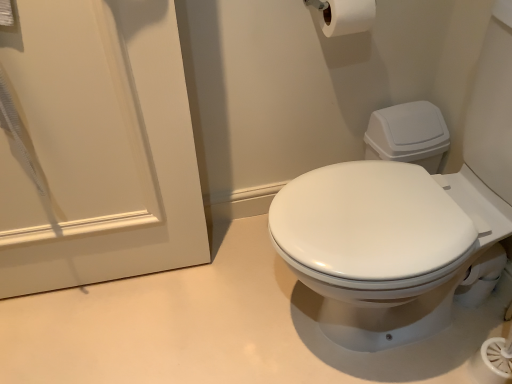
What is the approximate width of white matte toilet paper at upper center?

white matte toilet paper at upper center is 5.51 inches in width.

This screenshot has height=384, width=512. I want to click on white matte toilet paper at upper center, so click(x=347, y=16).

What do you see at coordinates (347, 16) in the screenshot?
I see `white matte toilet paper at upper center` at bounding box center [347, 16].

What do you see at coordinates (98, 146) in the screenshot? The image size is (512, 384). I see `white matte door at upper left` at bounding box center [98, 146].

The height and width of the screenshot is (384, 512). I want to click on white matte door at upper left, so click(x=98, y=146).

In order to face white matte door at upper left, should I rotate leftwards or rightwards?

To face it directly, rotate left by 23.850 degrees.

At what (x,y) coordinates should I click in order to perform the action: click on white matte toilet paper at upper center. Please return your answer as a coordinate pair (x, y). Looking at the image, I should click on (347, 16).

Visually, is white matte toilet paper at upper center positioned to the left or to the right of white matte door at upper left?

In the image, white matte toilet paper at upper center appears on the right side of white matte door at upper left.

Is the depth of white matte toilet paper at upper center greater than that of white matte door at upper left?

Yes, it is behind white matte door at upper left.

Does point (361, 12) appear closer or farther from the camera than point (137, 120)?

Point (361, 12).

From the image's perspective, is white matte toilet paper at upper center on top of white matte door at upper left?

Yes.

From a real-world perspective, which object stands above the other?

white matte toilet paper at upper center is physically above.

Between white matte toilet paper at upper center and white matte door at upper left, which one has larger width?

white matte toilet paper at upper center.

Is white matte toilet paper at upper center taller than white matte door at upper left?

No.

Can you confirm if white matte toilet paper at upper center is smaller than white matte door at upper left?

Yes.

Would you say white matte toilet paper at upper center is inside or outside white matte door at upper left?

white matte toilet paper at upper center is located beyond the bounds of white matte door at upper left.

Does white matte toilet paper at upper center touch white matte door at upper left?

No, white matte toilet paper at upper center is not with white matte door at upper left.

Is white matte door at upper left at the back of white matte toilet paper at upper center?

white matte toilet paper at upper center is not turned away from white matte door at upper left.

Image resolution: width=512 pixels, height=384 pixels. What are the coordinates of `screen door below the white matte toilet paper at upper center (from the image's perspective)` in the screenshot? It's located at (98, 146).

Which is more to the right, white matte door at upper left or white matte toilet paper at upper center?

white matte toilet paper at upper center is more to the right.

Does white matte door at upper left come in front of white matte toilet paper at upper center?

Yes, it is in front of white matte toilet paper at upper center.

Does point (59, 278) come behind point (367, 17)?

Yes, it is behind point (367, 17).

From the image's perspective, between white matte door at upper left and white matte toilet paper at upper center, who is located below?

white matte door at upper left.

From a real-world perspective, is white matte door at upper left on top of white matte toilet paper at upper center?

No, from a real-world perspective, white matte door at upper left is not above white matte toilet paper at upper center.

Considering the sizes of white matte door at upper left and white matte toilet paper at upper center in the image, is white matte door at upper left wider or thinner than white matte toilet paper at upper center?

white matte door at upper left is thinner than white matte toilet paper at upper center.

Between white matte door at upper left and white matte toilet paper at upper center, which one has more height?

white matte door at upper left is taller.

Considering the sizes of objects white matte door at upper left and white matte toilet paper at upper center in the image provided, who is smaller, white matte door at upper left or white matte toilet paper at upper center?

white matte toilet paper at upper center.

Which is correct: white matte door at upper left is inside white matte toilet paper at upper center, or outside of it?

The correct answer is: outside.

Is there a large distance between white matte door at upper left and white matte toilet paper at upper center?

No, white matte door at upper left is in close proximity to white matte toilet paper at upper center.

In the scene shown: Does white matte door at upper left turn towards white matte toilet paper at upper center?

No, white matte door at upper left is not facing towards white matte toilet paper at upper center.

Where is `toilet paper on the right of the white matte door at upper left`? Image resolution: width=512 pixels, height=384 pixels. toilet paper on the right of the white matte door at upper left is located at coordinates (347, 16).

I want to click on screen door located underneath the white matte toilet paper at upper center (from a real-world perspective), so click(x=98, y=146).

Image resolution: width=512 pixels, height=384 pixels. In order to click on toilet paper above the white matte door at upper left (from a real-world perspective) in this screenshot , I will do `click(347, 16)`.